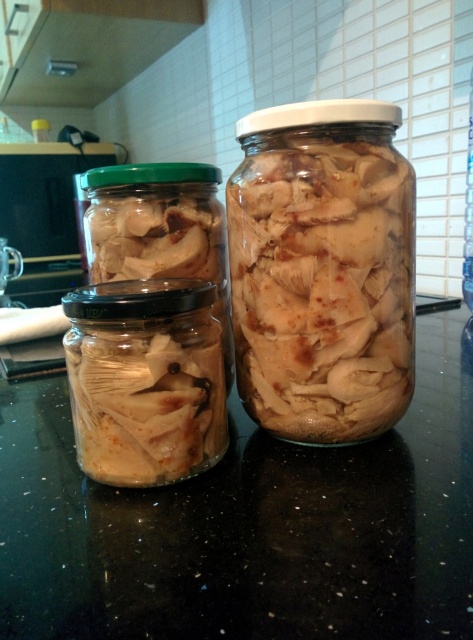
Question: Which of the following is the closest to the observer?

Choices:
 (A) (102, 433)
 (B) (151, 636)
 (C) (464, 280)
 (D) (350, 355)

Answer: (B)

Question: Is transparent glass jars at center closer to camera compared to translucent glass jar at center?

Choices:
 (A) yes
 (B) no

Answer: (A)

Question: Is transparent glass jars at center to the left of clear glass bottle at center from the viewer's perspective?

Choices:
 (A) yes
 (B) no

Answer: (A)

Question: Estimate the real-world distances between objects in this image. Which object is closer to the clear glass bottle at center?

Choices:
 (A) transparent glass jars at center
 (B) translucent glass jar at center
 (C) translucent glass mushrooms at center

Answer: (A)

Question: Considering the real-world distances, which object is farthest from the transparent glass jars at center?

Choices:
 (A) translucent glass jar at center
 (B) clear glass bottle at center

Answer: (B)

Question: Is transparent glass jars at center to the right of translucent glass jar at center from the viewer's perspective?

Choices:
 (A) yes
 (B) no

Answer: (A)